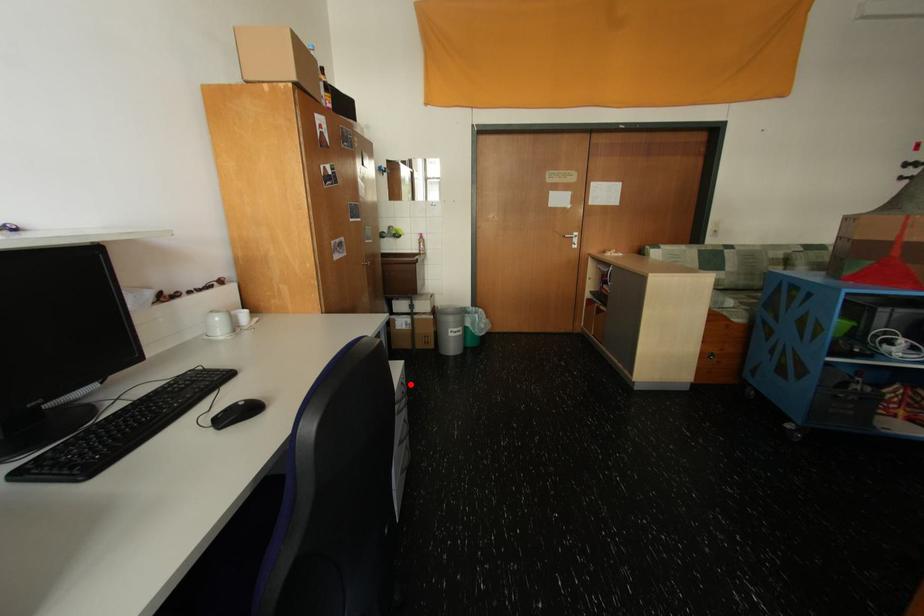
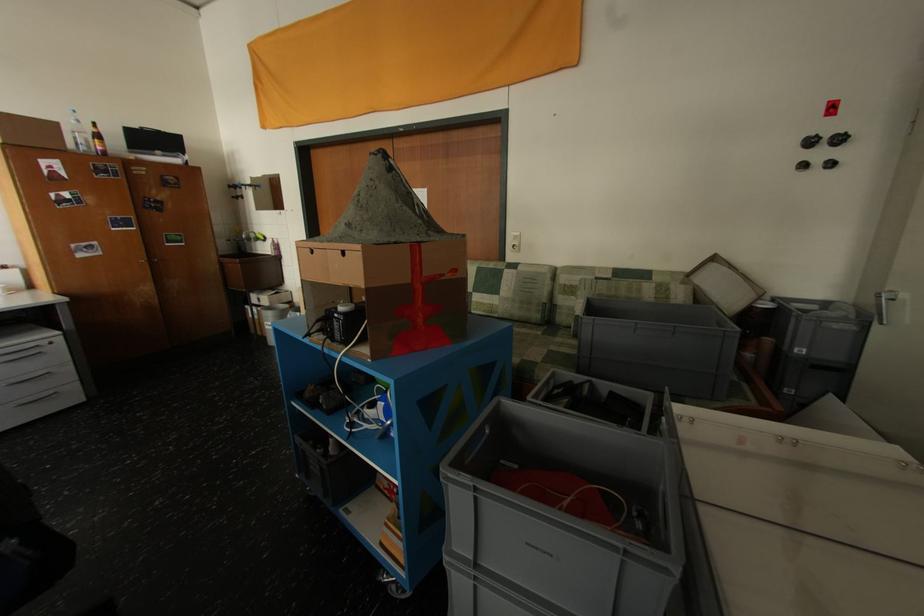
Locate, in the second image, the point that corresponds to the highlighted location in the first image.

(45, 347)